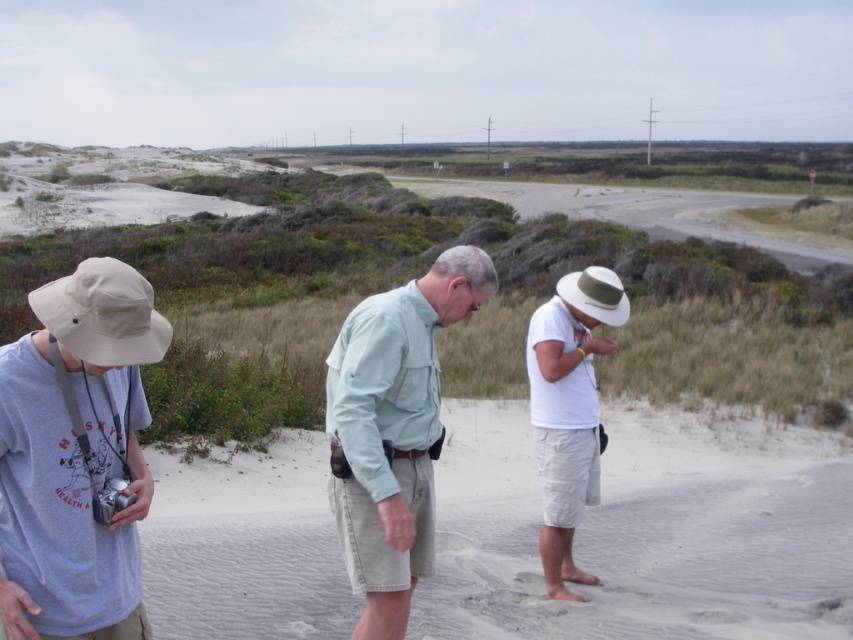
Question: Which of the following is the farthest from the observer?

Choices:
 (A) white matte hat at center
 (B) light beige fabric hat at left
 (C) light green fabric shirt at center

Answer: (A)

Question: In this image, where is khaki cotton hat at center located relative to light green fabric shirt at center?

Choices:
 (A) left
 (B) right

Answer: (B)

Question: Where is khaki cotton hat at center located in relation to light green fabric shirt at center in the image?

Choices:
 (A) below
 (B) above

Answer: (A)

Question: Which of the following is the closest to the observer?

Choices:
 (A) white matte hat at center
 (B) khaki cotton hat at center

Answer: (B)

Question: Which object is farther from the camera taking this photo?

Choices:
 (A) light green fabric shirt at center
 (B) khaki cotton hat at center
 (C) light beige fabric hat at left

Answer: (B)

Question: Does khaki cotton hat at center appear on the right side of light green fabric shirt at center?

Choices:
 (A) no
 (B) yes

Answer: (B)